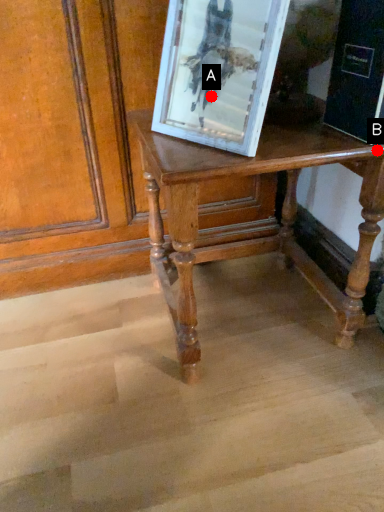
Question: Two points are circled on the image, labeled by A and B beside each circle. Which of the following is the closest to the observer?

Choices:
 (A) A is closer
 (B) B is closer

Answer: (B)